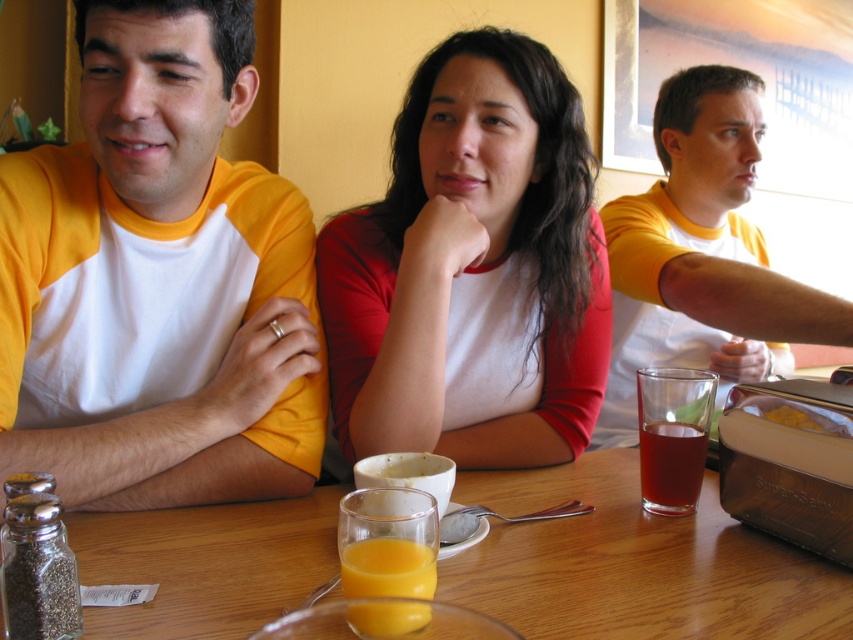
Question: Considering the relative positions of orange translucent glass at center and translucent glass at table center in the image provided, where is orange translucent glass at center located with respect to translucent glass at table center?

Choices:
 (A) above
 (B) below

Answer: (B)

Question: Which object is farther from the camera taking this photo?

Choices:
 (A) matte white shirt at center
 (B) translucent glass at table center
 (C) wooden table at center

Answer: (A)

Question: Can you confirm if yellow cotton shirt at left is bigger than yellow cotton shirt at upper right?

Choices:
 (A) no
 (B) yes

Answer: (A)

Question: Considering the real-world distances, which object is closest to the yellow cotton shirt at left?

Choices:
 (A) matte white shirt at center
 (B) translucent glass at table center

Answer: (A)

Question: Can you confirm if wooden table at center is positioned to the left of yellow cotton shirt at upper right?

Choices:
 (A) no
 (B) yes

Answer: (B)

Question: Which object is closer to the camera taking this photo?

Choices:
 (A) yellow cotton shirt at left
 (B) matte white shirt at center

Answer: (A)